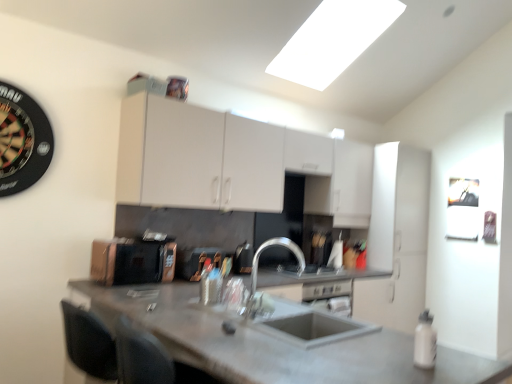
Question: Looking at their shapes, would you say concrete gray countertop at center is wider or thinner than metallic silver toaster at center, which ranks as the 2th appliance in right-to-left order?

Choices:
 (A) thin
 (B) wide

Answer: (B)

Question: From a real-world perspective, is concrete gray countertop at center above or below metallic silver toaster at center, the 2th appliance in the left-to-right sequence?

Choices:
 (A) above
 (B) below

Answer: (B)

Question: Based on their relative distances, which object is farther from the matte copper toaster at center, which appears as the third appliance when viewed from the right?

Choices:
 (A) satin silver gas stove at center
 (B) white matte cabinet at center, the 1th cabinetry from the right
 (C) satin nickel faucet at center, which is the third appliance in left-to-right order
 (D) concrete gray countertop at center
 (E) silver metallic faucet at center

Answer: (B)

Question: Estimate the real-world distances between objects in this image. Which object is farther from the metallic silver toaster at center, which ranks as the 2th appliance in right-to-left order?

Choices:
 (A) white matte cabinet at center, which is counted as the 2th cabinetry, starting from the left
 (B) white matte bottle at lower right
 (C) silver metallic faucet at center
 (D) satin nickel faucet at center, the first appliance in the right-to-left sequence
 (E) concrete gray countertop at center

Answer: (A)